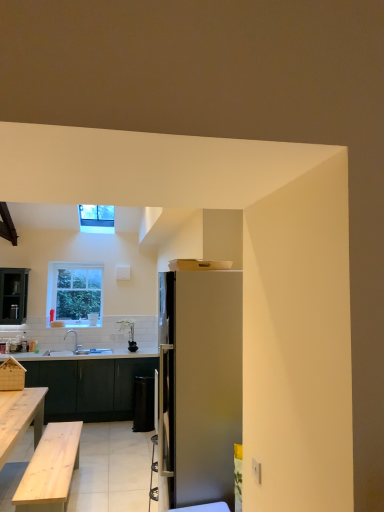
Describe the element at coordinates (199, 385) in the screenshot. I see `satin silver refrigerator at center` at that location.

This screenshot has width=384, height=512. Find the location of `satin silver refrigerator at center`. satin silver refrigerator at center is located at coordinates (199, 385).

In order to click on wooden table at lower left in this screenshot , I will do `click(88, 387)`.

You are a GUI agent. You are given a task and a screenshot of the screen. Output one action in this format:
    pyautogui.click(x=<x>, y=<y>)
    Task: Click on the clear glass window at upper center, positioned as the 1th window in front-to-back order
    The width and height of the screenshot is (384, 512).
    Given the screenshot: What is the action you would take?
    pyautogui.click(x=96, y=218)

Based on their sizes in the image, would you say white glossy sink at lower left is bigger or smaller than clear glass window at upper center, positioned as the 1th window in top-to-bottom order?

white glossy sink at lower left is bigger than clear glass window at upper center, positioned as the 1th window in top-to-bottom order.

Can you confirm if white glossy sink at lower left is positioned to the left of clear glass window at upper center, which is the second window in bottom-to-top order?

Yes.

Where is `sink below the clear glass window at upper center, which is the second window in back-to-front order (from the image's perspective)`? sink below the clear glass window at upper center, which is the second window in back-to-front order (from the image's perspective) is located at coordinates (73, 344).

In the image, is white glossy sink at lower left positioned in front of or behind clear glass window at upper center, which is the second window in back-to-front order?

In the image, white glossy sink at lower left appears behind clear glass window at upper center, which is the second window in back-to-front order.

From the image's perspective, is clear glass window at upper left, placed as the 2th window when sorted from front to back, beneath black matte trash bin/can at center?

No, from the image's perspective, clear glass window at upper left, placed as the 2th window when sorted from front to back, is not below black matte trash bin/can at center.

At what (x,y) coordinates should I click in order to perform the action: click on trash bin/can below the clear glass window at upper left, which appears as the 1th window when ordered from the bottom (from the image's perspective). Please return your answer as a coordinate pair (x, y). The height and width of the screenshot is (512, 384). Looking at the image, I should click on coord(143,404).

Would you consider clear glass window at upper left, placed as the 2th window when sorted from front to back, to be distant from black matte trash bin/can at center?

clear glass window at upper left, placed as the 2th window when sorted from front to back, is far away from black matte trash bin/can at center.

Considering the sizes of white glossy sink at lower left and natural wood bench at left in the image, is white glossy sink at lower left taller or shorter than natural wood bench at left?

white glossy sink at lower left is shorter than natural wood bench at left.

From a real-world perspective, between white glossy sink at lower left and natural wood bench at left, who is vertically higher?

white glossy sink at lower left.

You are a GUI agent. You are given a task and a screenshot of the screen. Output one action in this format:
    pyautogui.click(x=<x>, y=<y>)
    Task: Click on the desk to the left of white glossy sink at lower left
    
    Given the screenshot: What is the action you would take?
    pyautogui.click(x=20, y=417)

Does black matte trash bin/can at center touch clear glass window at upper left, placed as the 2th window when sorted from front to back?

black matte trash bin/can at center and clear glass window at upper left, placed as the 2th window when sorted from front to back, are clearly separated.

Would you say black matte trash bin/can at center is inside or outside clear glass window at upper left, placed as the 2th window when sorted from front to back?

The correct answer is: outside.

From a real-world perspective, is black matte trash bin/can at center positioned above or below clear glass window at upper left, positioned as the 1th window in back-to-front order?

From a real-world perspective, black matte trash bin/can at center is physically below clear glass window at upper left, positioned as the 1th window in back-to-front order.

Does clear glass window at upper center, which is the second window in bottom-to-top order, have a smaller size compared to wooden table at lower left?

Indeed, clear glass window at upper center, which is the second window in bottom-to-top order, has a smaller size compared to wooden table at lower left.

In the scene shown: Does clear glass window at upper center, positioned as the 1th window in top-to-bottom order, have a lesser height compared to wooden table at lower left?

Indeed, clear glass window at upper center, positioned as the 1th window in top-to-bottom order, has a lesser height compared to wooden table at lower left.

From a real-world perspective, who is located lower, clear glass window at upper center, which is the second window in bottom-to-top order, or wooden table at lower left?

From a 3D spatial view, wooden table at lower left is below.

Is point (99, 353) positioned before point (68, 280)?

Yes, point (99, 353) is in front of point (68, 280).

From the image's perspective, is white glossy sink at lower left located above or below clear glass window at upper left, which appears as the 1th window when ordered from the bottom?

Clearly, from the image's perspective, white glossy sink at lower left is below clear glass window at upper left, which appears as the 1th window when ordered from the bottom.

Considering their positions, is white glossy sink at lower left located in front of or behind clear glass window at upper left, positioned as the second window in top-to-bottom order?

Visually, white glossy sink at lower left is located in front of clear glass window at upper left, positioned as the second window in top-to-bottom order.

Considering the sizes of black matte trash bin/can at center and white glossy sink at lower left in the image, is black matte trash bin/can at center wider or thinner than white glossy sink at lower left?

Clearly, black matte trash bin/can at center has less width compared to white glossy sink at lower left.

Considering the relative sizes of black matte trash bin/can at center and white glossy sink at lower left in the image provided, is black matte trash bin/can at center smaller than white glossy sink at lower left?

Yes.

I want to click on trash bin/can in front of the white glossy sink at lower left, so click(143, 404).

Is black matte trash bin/can at center oriented towards white glossy sink at lower left?

No, black matte trash bin/can at center is not oriented towards white glossy sink at lower left.

Locate an element on the screen. The width and height of the screenshot is (384, 512). sink that appears on the left of clear glass window at upper center, which is the second window in back-to-front order is located at coordinates tap(73, 344).

From the image's perspective, which window is the 1st one above the black matte trash bin/can at center? Please provide its 2D coordinates.

[(75, 292)]

Estimate the real-world distances between objects in this image. Which object is closer to black matte trash bin/can at center, clear glass window at upper left, which appears as the 1th window when ordered from the bottom, or white glossy sink at lower left?

Based on the image, white glossy sink at lower left appears to be nearer to black matte trash bin/can at center.

Based on their spatial positions, is wooden table at lower left or natural wood bench at left closer to black matte trash bin/can at center?

wooden table at lower left is positioned closer to the anchor black matte trash bin/can at center.

Looking at this image, when comparing their distances from white glossy coffee cup at center, does black matte trash bin/can at center or wooden table at lower left seem closer?

wooden table at lower left lies closer to white glossy coffee cup at center than the other object.

From the image, which object appears to be farther from white glossy sink at lower left, white glossy coffee cup at center or natural wood bench at left?

Among the two, natural wood bench at left is located further to white glossy sink at lower left.

Estimate the real-world distances between objects in this image. Which object is closer to clear glass window at upper center, positioned as the 1th window in front-to-back order, satin silver refrigerator at center or black matte trash bin/can at center?

Based on the image, black matte trash bin/can at center appears to be nearer to clear glass window at upper center, positioned as the 1th window in front-to-back order.

Looking at the image, which one is located further to white glossy sink at lower left, satin silver refrigerator at center or clear glass window at upper center, which is the second window in back-to-front order?

satin silver refrigerator at center.

Considering their positions, is white glossy sink at lower left positioned closer to satin silver refrigerator at center than natural wood bench at left?

The object closer to satin silver refrigerator at center is natural wood bench at left.

Based on their spatial positions, is wooden table at lower left or clear glass window at upper left, placed as the 2th window when sorted from front to back, closer to natural wood bench at left?

wooden table at lower left.

The width and height of the screenshot is (384, 512). I want to click on sink that lies between clear glass window at upper center, positioned as the 1th window in top-to-bottom order, and wooden table at lower left from top to bottom, so [73, 344].

This screenshot has width=384, height=512. I want to click on trash bin/can positioned between satin silver refrigerator at center and clear glass window at upper left, positioned as the 1th window in back-to-front order, from near to far, so click(143, 404).

Where is `trash bin/can located between natural wood bench at left and white glossy coffee cup at center in the depth direction`? The image size is (384, 512). trash bin/can located between natural wood bench at left and white glossy coffee cup at center in the depth direction is located at coordinates (143, 404).

Image resolution: width=384 pixels, height=512 pixels. I want to click on kitchen & dining room table located between black matte trash bin/can at center and white glossy coffee cup at center in the depth direction, so click(88, 387).